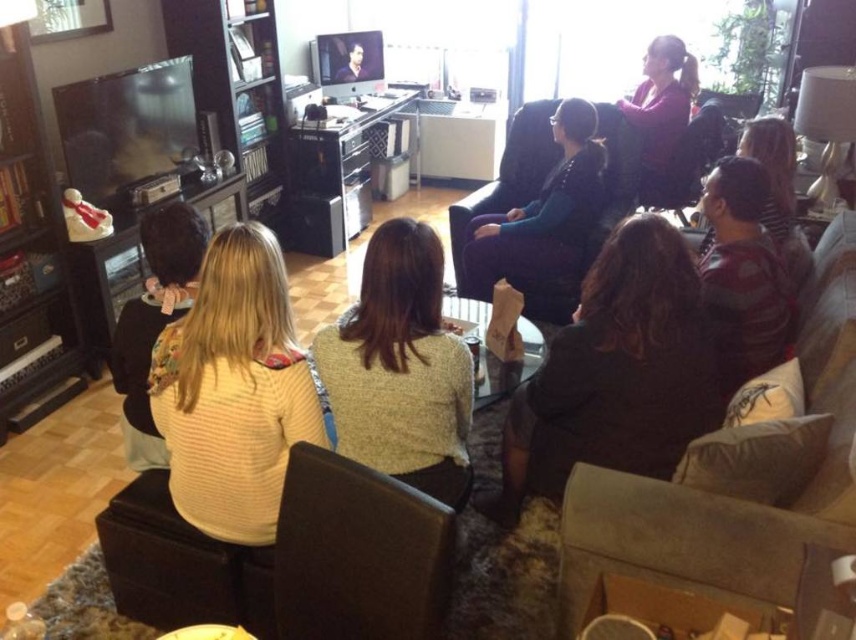
Question: Which of these objects is positioned farthest from the pink fabric at upper right?

Choices:
 (A) knitted yellow sweater at center
 (B) dark brown hair at center

Answer: (A)

Question: Which object appears farthest from the camera in this image?

Choices:
 (A) pink fabric at upper right
 (B) dark brown hair at center
 (C) dark brown leather armchair at center
 (D) yellow striped sweater at center

Answer: (A)

Question: In this image, where is knitted yellow sweater at center located relative to velvet dark purple armchair at center?

Choices:
 (A) below
 (B) above

Answer: (A)

Question: Which point is farther from the camera taking this photo?

Choices:
 (A) (548, 392)
 (B) (401, 467)

Answer: (A)

Question: Is dark brown fabric armchair at right to the left of knitted yellow sweater at center from the viewer's perspective?

Choices:
 (A) yes
 (B) no

Answer: (B)

Question: Can you confirm if striped cotton shirt at right is positioned below pink fabric at upper right?

Choices:
 (A) no
 (B) yes

Answer: (B)